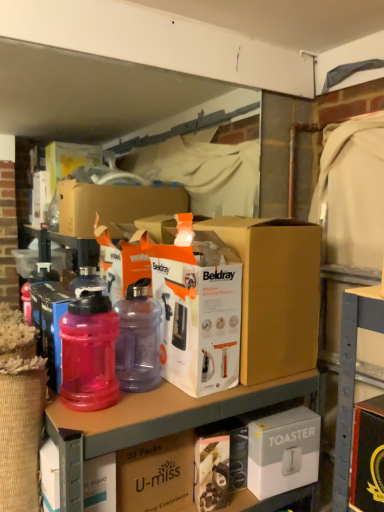
The image size is (384, 512). What do you see at coordinates (274, 293) in the screenshot?
I see `white cardboard box at center, placed as the 3th box when sorted from left to right` at bounding box center [274, 293].

What do you see at coordinates (156, 474) in the screenshot? I see `brown cardboard box at center, the third box from the right` at bounding box center [156, 474].

This screenshot has width=384, height=512. In order to click on purple translucent bottle at center, the second bottle when ordered from left to right in this screenshot , I will do `click(138, 339)`.

The width and height of the screenshot is (384, 512). Describe the element at coordinates (138, 339) in the screenshot. I see `purple translucent bottle at center, the first bottle when ordered from right to left` at that location.

Image resolution: width=384 pixels, height=512 pixels. I want to click on white cardboard box at center, placed as the 3th box when sorted from left to right, so click(274, 293).

From the image's perspective, is white cardboard toaster at lower right, the 1th box in the right-to-left sequence, under transparent plastic water bottle at left, the 4th box when ordered from right to left?

Indeed, from the image's perspective, white cardboard toaster at lower right, the 1th box in the right-to-left sequence, is shown beneath transparent plastic water bottle at left, the 4th box when ordered from right to left.

From a real-world perspective, is white cardboard toaster at lower right, which ranks as the fourth box in left-to-right order, positioned above or below transparent plastic water bottle at left, the 4th box when ordered from right to left?

white cardboard toaster at lower right, which ranks as the fourth box in left-to-right order, is situated lower than transparent plastic water bottle at left, the 4th box when ordered from right to left, in the real world.

Considering the relative sizes of white cardboard toaster at lower right, which ranks as the fourth box in left-to-right order, and transparent plastic water bottle at left, acting as the 1th box starting from the left, in the image provided, is white cardboard toaster at lower right, which ranks as the fourth box in left-to-right order, thinner than transparent plastic water bottle at left, acting as the 1th box starting from the left,?

In fact, white cardboard toaster at lower right, which ranks as the fourth box in left-to-right order, might be wider than transparent plastic water bottle at left, acting as the 1th box starting from the left.

Is white cardboard toaster at lower right, the 1th box in the right-to-left sequence, bigger than transparent plastic water bottle at left, the 4th box when ordered from right to left?

Indeed, white cardboard toaster at lower right, the 1th box in the right-to-left sequence, has a larger size compared to transparent plastic water bottle at left, the 4th box when ordered from right to left.

Between pink translucent bottle at left, which is the 2th bottle in right-to-left order, and brown cardboard box at center, the third box from the right, which one has smaller size?

pink translucent bottle at left, which is the 2th bottle in right-to-left order, is smaller.

Locate an element on the screen. The width and height of the screenshot is (384, 512). bottle in front of the brown cardboard box at center, the third box from the right is located at coordinates (89, 353).

From the image's perspective, which is below, pink translucent bottle at left, which is the 2th bottle in right-to-left order, or brown cardboard box at center, the third box from the right?

brown cardboard box at center, the third box from the right.

Looking at this image, from the image's perspective, is pink translucent bottle at left, which is the 2th bottle in right-to-left order, below transparent plastic water bottle at left, acting as the 1th box starting from the left?

Yes, from the image's perspective, pink translucent bottle at left, which is the 2th bottle in right-to-left order, is beneath transparent plastic water bottle at left, acting as the 1th box starting from the left.

Is pink translucent bottle at left, which is the 2th bottle in right-to-left order, next to transparent plastic water bottle at left, the 4th box when ordered from right to left, and touching it?

Yes.

Is pink translucent bottle at left, which is the 2th bottle in right-to-left order, turned away from transparent plastic water bottle at left, acting as the 1th box starting from the left?

Yes, transparent plastic water bottle at left, acting as the 1th box starting from the left, is at the back of pink translucent bottle at left, which is the 2th bottle in right-to-left order.

Is pink translucent bottle at left, which is the 2th bottle in right-to-left order, inside or outside of transparent plastic water bottle at left, the 4th box when ordered from right to left?

pink translucent bottle at left, which is the 2th bottle in right-to-left order, is not inside transparent plastic water bottle at left, the 4th box when ordered from right to left, it's outside.

Choose the correct answer: Is transparent plastic bottles at upper center inside brown cardboard box at center, the second box viewed from the left, or outside it?

The correct answer is: outside.

Consider the image. Is transparent plastic bottles at upper center not close to brown cardboard box at center, the second box viewed from the left?

No.

Considering the sizes of objects transparent plastic bottles at upper center and brown cardboard box at center, the third box from the right, in the image provided, who is shorter, transparent plastic bottles at upper center or brown cardboard box at center, the third box from the right,?

brown cardboard box at center, the third box from the right, is shorter.

Between transparent plastic bottles at upper center and brown cardboard box at center, the second box viewed from the left, which one has smaller size?

brown cardboard box at center, the second box viewed from the left.

In the image, is brown cardboard box at center, the third box from the right, positioned in front of or behind purple translucent bottle at center, the first bottle when ordered from right to left?

Visually, brown cardboard box at center, the third box from the right, is located in front of purple translucent bottle at center, the first bottle when ordered from right to left.

Can you see brown cardboard box at center, the second box viewed from the left, touching purple translucent bottle at center, the second bottle when ordered from left to right?

No, brown cardboard box at center, the second box viewed from the left, is not making contact with purple translucent bottle at center, the second bottle when ordered from left to right.

From a real-world perspective, which object rests below the other?

brown cardboard box at center, the third box from the right, from a real-world perspective.

From the image's perspective, starting from the brown cardboard box at center, the third box from the right, which bottle is the 2nd one above? Please provide its 2D coordinates.

[(138, 339)]

From a real-world perspective, who is located higher, purple translucent bottle at center, the first bottle when ordered from right to left, or white cardboard toaster at lower right, the 1th box in the right-to-left sequence?

In real-world perspective, purple translucent bottle at center, the first bottle when ordered from right to left, is above.

Is purple translucent bottle at center, the second bottle when ordered from left to right, oriented away from white cardboard toaster at lower right, which ranks as the fourth box in left-to-right order?

purple translucent bottle at center, the second bottle when ordered from left to right, is not turned away from white cardboard toaster at lower right, which ranks as the fourth box in left-to-right order.

Image resolution: width=384 pixels, height=512 pixels. There is a purple translucent bottle at center, the second bottle when ordered from left to right. Find the location of `the 3rd box below it (from a real-world perspective)`. the 3rd box below it (from a real-world perspective) is located at coordinates (283, 451).

Would you consider purple translucent bottle at center, the first bottle when ordered from right to left, to be distant from white cardboard toaster at lower right, which ranks as the fourth box in left-to-right order?

purple translucent bottle at center, the first bottle when ordered from right to left, is actually quite close to white cardboard toaster at lower right, which ranks as the fourth box in left-to-right order.

You are a GUI agent. You are given a task and a screenshot of the screen. Output one action in this format:
    pyautogui.click(x=<x>, y=<y>)
    Task: Click on the bottle above the purple translucent bottle at center, the second bottle when ordered from left to right (from a real-world perspective)
    The height and width of the screenshot is (512, 384).
    Given the screenshot: What is the action you would take?
    pyautogui.click(x=89, y=353)

Measure the distance between purple translucent bottle at center, the second bottle when ordered from left to right, and pink translucent bottle at left, which is the 2th bottle in right-to-left order.

3.43 inches.

From the image's perspective, which object appears higher, purple translucent bottle at center, the second bottle when ordered from left to right, or pink translucent bottle at left, the first bottle viewed from the left?

purple translucent bottle at center, the second bottle when ordered from left to right.

Does point (132, 381) come in front of point (94, 385)?

No, it is behind (94, 385).

I want to click on the 2nd box above the white cardboard toaster at lower right, which ranks as the fourth box in left-to-right order (from the image's perspective), so (x=50, y=323).

Where is `box that is the 2nd object directly below the pink translucent bottle at left, which is the 2th bottle in right-to-left order (from a real-world perspective)`? The width and height of the screenshot is (384, 512). box that is the 2nd object directly below the pink translucent bottle at left, which is the 2th bottle in right-to-left order (from a real-world perspective) is located at coordinates (156, 474).

From the image, which object appears to be farther from pink translucent bottle at left, the first bottle viewed from the left, white cardboard toaster at lower right, the 1th box in the right-to-left sequence, or purple translucent bottle at center, the second bottle when ordered from left to right?

The object further to pink translucent bottle at left, the first bottle viewed from the left, is white cardboard toaster at lower right, the 1th box in the right-to-left sequence.

When comparing their distances from white cardboard toaster at lower right, the 1th box in the right-to-left sequence, does brown cardboard box at center, the third box from the right, or transparent plastic bottles at upper center seem further?

The object further to white cardboard toaster at lower right, the 1th box in the right-to-left sequence, is brown cardboard box at center, the third box from the right.

Looking at this image, considering their positions, is white cardboard toaster at lower right, the 1th box in the right-to-left sequence, positioned closer to brown cardboard box at center, the third box from the right, than transparent plastic water bottle at left, the 4th box when ordered from right to left?

white cardboard toaster at lower right, the 1th box in the right-to-left sequence, is positioned closer to the anchor brown cardboard box at center, the third box from the right.

Which object lies further to the anchor point brown cardboard box at center, the second box viewed from the left, transparent plastic water bottle at left, acting as the 1th box starting from the left, or purple translucent bottle at center, the first bottle when ordered from right to left?

Among the two, transparent plastic water bottle at left, acting as the 1th box starting from the left, is located further to brown cardboard box at center, the second box viewed from the left.

In the scene shown: When comparing their distances from transparent plastic bottles at upper center, does purple translucent bottle at center, the second bottle when ordered from left to right, or white cardboard toaster at lower right, which ranks as the fourth box in left-to-right order, seem closer?

purple translucent bottle at center, the second bottle when ordered from left to right, is closer to transparent plastic bottles at upper center.

Based on their spatial positions, is pink translucent bottle at left, the first bottle viewed from the left, or purple translucent bottle at center, the first bottle when ordered from right to left, further from transparent plastic bottles at upper center?

Based on the image, purple translucent bottle at center, the first bottle when ordered from right to left, appears to be further to transparent plastic bottles at upper center.

Which object lies nearer to the anchor point transparent plastic water bottle at left, the 4th box when ordered from right to left, white cardboard toaster at lower right, the 1th box in the right-to-left sequence, or transparent plastic bottles at upper center?

transparent plastic bottles at upper center is positioned closer to the anchor transparent plastic water bottle at left, the 4th box when ordered from right to left.

From the picture: Based on their spatial positions, is pink translucent bottle at left, the first bottle viewed from the left, or brown cardboard box at center, the third box from the right, further from purple translucent bottle at center, the first bottle when ordered from right to left?

The object further to purple translucent bottle at center, the first bottle when ordered from right to left, is brown cardboard box at center, the third box from the right.

You are a GUI agent. You are given a task and a screenshot of the screen. Output one action in this format:
    pyautogui.click(x=<x>, y=<y>)
    Task: Click on the bottle between pink translucent bottle at left, the first bottle viewed from the left, and white cardboard box at center, the second box when ordered from right to left, from left to right
    The height and width of the screenshot is (512, 384).
    Given the screenshot: What is the action you would take?
    pyautogui.click(x=138, y=339)

Where is `bottle situated between transparent plastic water bottle at left, the 4th box when ordered from right to left, and purple translucent bottle at center, the first bottle when ordered from right to left, from left to right`? This screenshot has width=384, height=512. bottle situated between transparent plastic water bottle at left, the 4th box when ordered from right to left, and purple translucent bottle at center, the first bottle when ordered from right to left, from left to right is located at coordinates (89, 353).

The width and height of the screenshot is (384, 512). Identify the location of workbench between transparent plastic water bottle at left, acting as the 1th box starting from the left, and white cardboard toaster at lower right, the 1th box in the right-to-left sequence, in the horizontal direction. point(172,412).

Find the location of a particular element. workbench between pink translucent bottle at left, which is the 2th bottle in right-to-left order, and white cardboard toaster at lower right, which ranks as the fourth box in left-to-right order, in the horizontal direction is located at coordinates (172, 412).